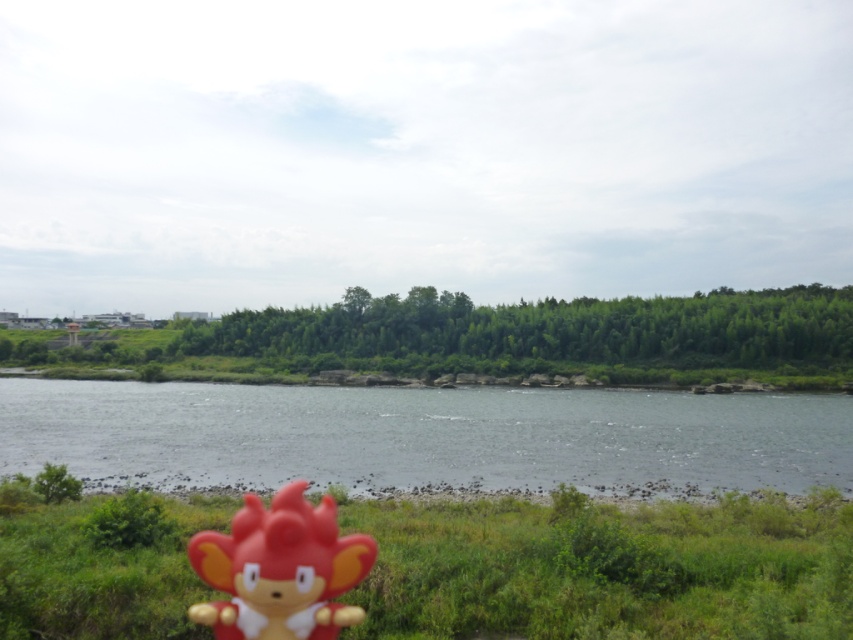
Does green matte grass at lower center appear on the left side of glossy water at center?

Correct, you'll find green matte grass at lower center to the left of glossy water at center.

Which is behind, point (120, 616) or point (114, 476)?

The point (114, 476) is behind.

This screenshot has width=853, height=640. What are the coordinates of `green matte grass at lower center` in the screenshot? It's located at (606, 568).

Based on the photo, who is lower down, green matte grass at lower center or matte plastic toy at lower center?

matte plastic toy at lower center is lower down.

What are the coordinates of `green matte grass at lower center` in the screenshot? It's located at (606, 568).

The height and width of the screenshot is (640, 853). Find the location of `green matte grass at lower center`. green matte grass at lower center is located at coordinates (606, 568).

Is glossy water at center shorter than matte plastic toy at lower center?

Indeed, glossy water at center has a lesser height compared to matte plastic toy at lower center.

Between point (291, 456) and point (312, 568), which one is positioned in front?

Point (312, 568) is in front.

Which is behind, point (178, 387) or point (257, 577)?

The point (178, 387) is behind.

Find the location of a particular element. glossy water at center is located at coordinates (424, 436).